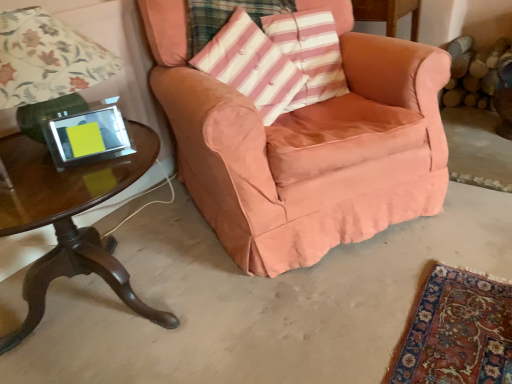
Where is `free spot to the right of shiny dark wood table at lower left`? This screenshot has width=512, height=384. free spot to the right of shiny dark wood table at lower left is located at coordinates pos(269,318).